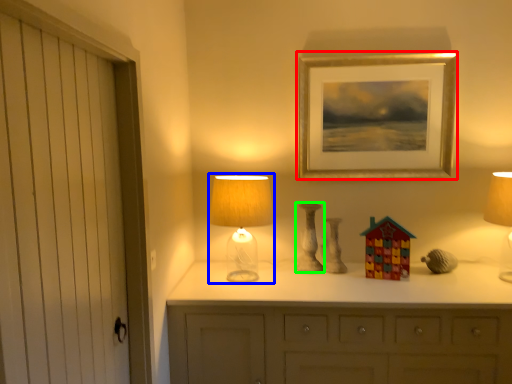
Question: Considering the real-world distances, which object is closest to picture frame (highlighted by a red box)? table lamp (highlighted by a blue box) or candle holder (highlighted by a green box).

Choices:
 (A) table lamp
 (B) candle holder

Answer: (B)